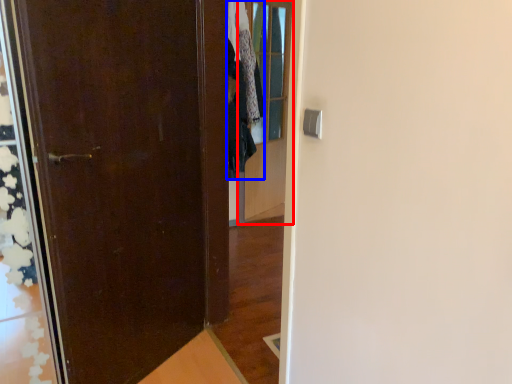
Question: Among these objects, which one is nearest to the camera, glass door (highlighted by a red box) or clothing (highlighted by a blue box)?

Choices:
 (A) glass door
 (B) clothing

Answer: (B)